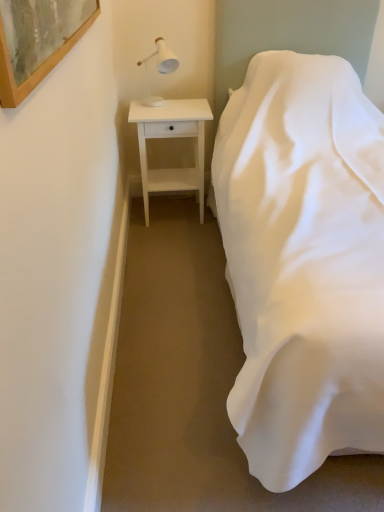
The height and width of the screenshot is (512, 384). What are the coordinates of `free point below white matte table lamp at upper left (from a real-world perspective)` in the screenshot? It's located at (169, 103).